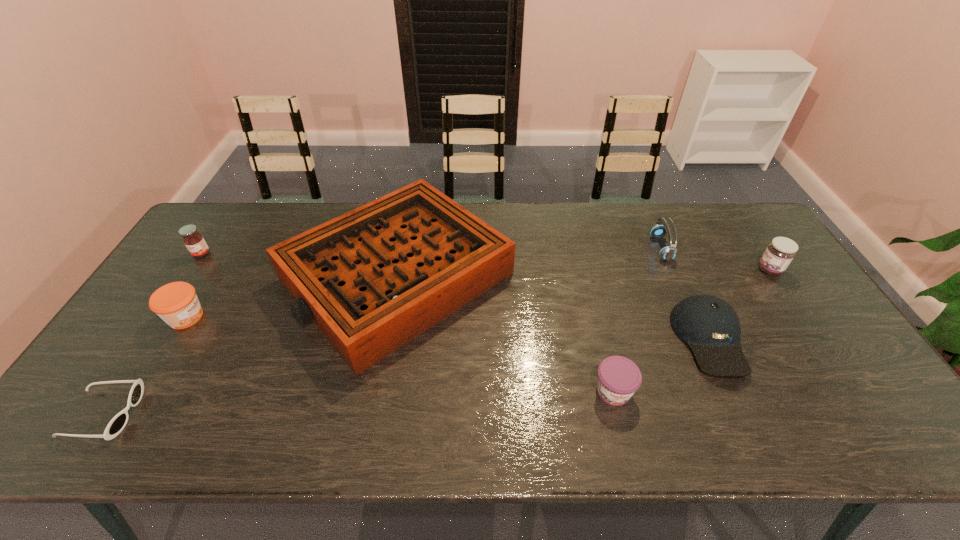
Select which object is the closest to the fourth object from right to left. Please provide its 2D coordinates. Your answer should be formatted as a tuple, i.e. [(x, y)], where the tuple contains the x and y coordinates of a point satisfying the conditions above.

[(710, 326)]

Where is `the second closest jam to the rightmost jam`? the second closest jam to the rightmost jam is located at coordinates (176, 303).

Point out which jam is positioned as the third nearest to the second jam from right to left. Please provide its 2D coordinates. Your answer should be formatted as a tuple, i.e. [(x, y)], where the tuple contains the x and y coordinates of a point satisfying the conditions above.

[(195, 243)]

Identify the location of free spot that satisfies the following two spatial constraints: 1. on the front label of the third jam from left to right; 2. with the lenses of the shortest object facing outward. This screenshot has width=960, height=540. (618, 414).

Locate an element on the screen. The height and width of the screenshot is (540, 960). free space that satisfies the following two spatial constraints: 1. on the ear cups of the headset; 2. on the front label of the nearest jam is located at coordinates (724, 391).

This screenshot has width=960, height=540. In order to click on vacant space that satisfies the following two spatial constraints: 1. on the ear cups of the headset; 2. on the front label of the nearest jam in this screenshot , I will do `click(724, 391)`.